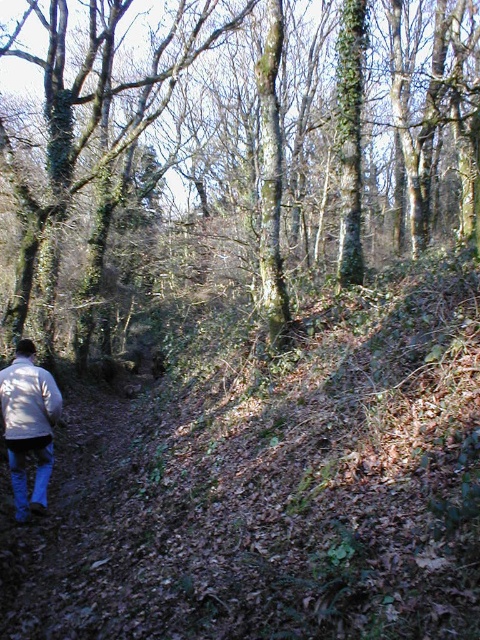
Question: Considering the relative positions of green rough bark tree at center and white matte jacket at lower left in the image provided, where is green rough bark tree at center located with respect to white matte jacket at lower left?

Choices:
 (A) above
 (B) below

Answer: (A)

Question: Can you confirm if green rough bark tree at center is thinner than white matte jacket at lower left?

Choices:
 (A) no
 (B) yes

Answer: (A)

Question: Among these points, which one is farthest from the camera?

Choices:
 (A) coord(356,225)
 (B) coord(46,440)

Answer: (A)

Question: Does green rough bark tree at center appear under white matte jacket at lower left?

Choices:
 (A) no
 (B) yes

Answer: (A)